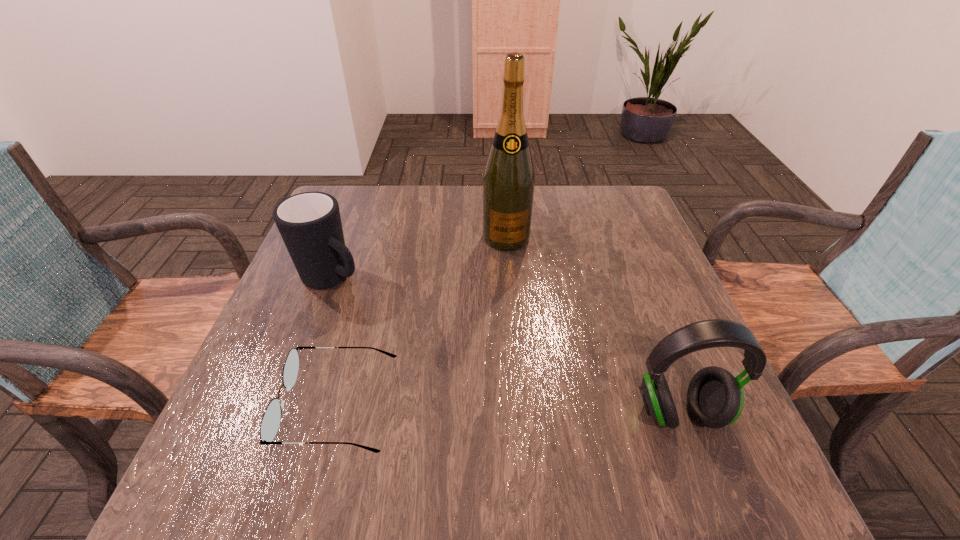
The height and width of the screenshot is (540, 960). I want to click on vacant area situated 0.170m on the side of the mug with the handle, so click(x=408, y=326).

Where is `vacant position located 0.050m on the side of the mug with the handle`? vacant position located 0.050m on the side of the mug with the handle is located at coordinates (371, 302).

The width and height of the screenshot is (960, 540). In order to click on object situated at the far edge in this screenshot , I will do `click(508, 185)`.

Where is `spectacles that is positioned at the near edge`? spectacles that is positioned at the near edge is located at coordinates (270, 422).

I want to click on headset that is at the near edge, so click(715, 398).

Where is `spectacles positioned at the left edge`? Image resolution: width=960 pixels, height=540 pixels. spectacles positioned at the left edge is located at coordinates (270, 422).

What are the coordinates of `mug that is at the left edge` in the screenshot? It's located at (310, 225).

Where is `object positioned at the right edge`? The image size is (960, 540). object positioned at the right edge is located at coordinates (715, 398).

Where is `object at the near left corner`? This screenshot has width=960, height=540. object at the near left corner is located at coordinates (270, 422).

Locate an element on the screen. object that is at the near right corner is located at coordinates (715, 398).